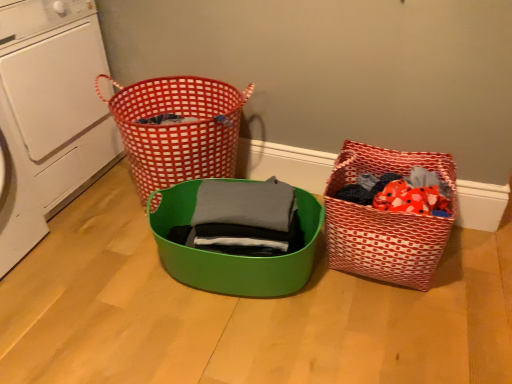
The image size is (512, 384). Identify the location of white plastic washing machine at left. (50, 115).

Based on the photo, measure the distance between point (70, 74) and camera.

The distance of point (70, 74) from camera is 5.40 feet.

Image resolution: width=512 pixels, height=384 pixels. What do you see at coordinates (178, 129) in the screenshot?
I see `red checkered basket at upper left` at bounding box center [178, 129].

Image resolution: width=512 pixels, height=384 pixels. Describe the element at coordinates (232, 255) in the screenshot. I see `matte green bowl at center, placed as the first basket when sorted from left to right` at that location.

You are a GUI agent. You are given a task and a screenshot of the screen. Output one action in this format:
    pyautogui.click(x=<x>, y=<y>)
    Task: Click on the red woven fabric basket at lower right, which is the second basket from left to right
    
    Given the screenshot: What is the action you would take?
    pyautogui.click(x=385, y=220)

Would you say red woven fabric basket at lower right, which is the second basket from left to right, is part of white plastic washing machine at left's contents?

No, red woven fabric basket at lower right, which is the second basket from left to right, is not inside white plastic washing machine at left.

Does white plastic washing machine at left lie behind red woven fabric basket at lower right, which is the second basket from left to right?

Yes, it is behind red woven fabric basket at lower right, which is the second basket from left to right.

Does white plastic washing machine at left have a greater width compared to red woven fabric basket at lower right, which is the second basket from left to right?

Yes.

Find the location of a particular element. washing machine that appears behind the red woven fabric basket at lower right, which appears as the first basket when viewed from the right is located at coordinates (50, 115).

Locate an element on the screen. waste container behind the red woven fabric basket at lower right, which is the second basket from left to right is located at coordinates (178, 129).

Can you tell me how much red woven fabric basket at lower right, which is the second basket from left to right, and red checkered basket at upper left differ in facing direction?

1.84 degrees.

Consider the image. From the image's perspective, is red woven fabric basket at lower right, which appears as the first basket when viewed from the right, on top of red checkered basket at upper left?

No, from the image's perspective, red woven fabric basket at lower right, which appears as the first basket when viewed from the right, is not on top of red checkered basket at upper left.

From a real-world perspective, between red woven fabric basket at lower right, which is the second basket from left to right, and red checkered basket at upper left, who is vertically lower?

red woven fabric basket at lower right, which is the second basket from left to right.

Which object is thinner, matte green bowl at center, which ranks as the second basket in right-to-left order, or red checkered basket at upper left?

matte green bowl at center, which ranks as the second basket in right-to-left order, is thinner.

From a real-world perspective, between matte green bowl at center, placed as the first basket when sorted from left to right, and red checkered basket at upper left, who is vertically higher?

In real-world perspective, matte green bowl at center, placed as the first basket when sorted from left to right, is above.

Consider the image. Which is more to the right, matte green bowl at center, placed as the first basket when sorted from left to right, or red checkered basket at upper left?

matte green bowl at center, placed as the first basket when sorted from left to right, is more to the right.

Based on the photo, what's the angular difference between red checkered basket at upper left and red woven fabric basket at lower right, which appears as the first basket when viewed from the right,'s facing directions?

The facing directions of red checkered basket at upper left and red woven fabric basket at lower right, which appears as the first basket when viewed from the right, are 1.84 degrees apart.

Can you confirm if red checkered basket at upper left is smaller than red woven fabric basket at lower right, which appears as the first basket when viewed from the right?

No.

Can you confirm if red checkered basket at upper left is wider than red woven fabric basket at lower right, which appears as the first basket when viewed from the right?

Yes.

Which is further, (241, 108) or (393, 275)?

Positioned behind is point (241, 108).

In the scene shown: Can you confirm if red woven fabric basket at lower right, which is the second basket from left to right, is bigger than matte green bowl at center, which ranks as the second basket in right-to-left order?

Yes, red woven fabric basket at lower right, which is the second basket from left to right, is bigger than matte green bowl at center, which ranks as the second basket in right-to-left order.

Is red woven fabric basket at lower right, which is the second basket from left to right, thinner than matte green bowl at center, which ranks as the second basket in right-to-left order?

Incorrect, the width of red woven fabric basket at lower right, which is the second basket from left to right, is not less than that of matte green bowl at center, which ranks as the second basket in right-to-left order.

Who is shorter, red woven fabric basket at lower right, which is the second basket from left to right, or matte green bowl at center, placed as the first basket when sorted from left to right?

matte green bowl at center, placed as the first basket when sorted from left to right.

Is red checkered basket at upper left positioned with its back to matte green bowl at center, which ranks as the second basket in right-to-left order?

red checkered basket at upper left is not turned away from matte green bowl at center, which ranks as the second basket in right-to-left order.

Between red checkered basket at upper left and matte green bowl at center, which ranks as the second basket in right-to-left order, which one has less height?

Standing shorter between the two is matte green bowl at center, which ranks as the second basket in right-to-left order.

Are red checkered basket at upper left and matte green bowl at center, placed as the first basket when sorted from left to right, far apart?

They are positioned close to each other.

From a real-world perspective, does red checkered basket at upper left sit lower than matte green bowl at center, placed as the first basket when sorted from left to right?

Yes, from a real-world perspective, red checkered basket at upper left is below matte green bowl at center, placed as the first basket when sorted from left to right.

What's the angular difference between white plastic washing machine at left and red checkered basket at upper left's facing directions?

They differ by 92.6 degrees in their facing directions.

From the image's perspective, which object appears higher, white plastic washing machine at left or red checkered basket at upper left?

white plastic washing machine at left, from the image's perspective.

Is white plastic washing machine at left taller than red checkered basket at upper left?

Indeed, white plastic washing machine at left has a greater height compared to red checkered basket at upper left.

Choose the correct answer: Is white plastic washing machine at left inside red checkered basket at upper left or outside it?

white plastic washing machine at left exists outside the volume of red checkered basket at upper left.

Find the location of `the 1st basket below the white plastic washing machine at left (from the image's perspective)`. the 1st basket below the white plastic washing machine at left (from the image's perspective) is located at coordinates (385, 220).

Identify the location of waste container that is above the red woven fabric basket at lower right, which is the second basket from left to right (from the image's perspective). (178, 129).

When comparing their distances from red checkered basket at upper left, does white plastic washing machine at left or matte green bowl at center, placed as the first basket when sorted from left to right, seem further?

white plastic washing machine at left lies further to red checkered basket at upper left than the other object.

When comparing their distances from red woven fabric basket at lower right, which appears as the first basket when viewed from the right, does white plastic washing machine at left or red checkered basket at upper left seem closer?

red checkered basket at upper left is positioned closer to the anchor red woven fabric basket at lower right, which appears as the first basket when viewed from the right.

Looking at the image, which one is located closer to red checkered basket at upper left, matte green bowl at center, placed as the first basket when sorted from left to right, or white plastic washing machine at left?

matte green bowl at center, placed as the first basket when sorted from left to right, is positioned closer to the anchor red checkered basket at upper left.

Considering their positions, is red woven fabric basket at lower right, which appears as the first basket when viewed from the right, positioned further to white plastic washing machine at left than matte green bowl at center, placed as the first basket when sorted from left to right?

Among the two, red woven fabric basket at lower right, which appears as the first basket when viewed from the right, is located further to white plastic washing machine at left.

Estimate the real-world distances between objects in this image. Which object is closer to red woven fabric basket at lower right, which is the second basket from left to right, red checkered basket at upper left or white plastic washing machine at left?

The object closer to red woven fabric basket at lower right, which is the second basket from left to right, is red checkered basket at upper left.

Looking at the image, which one is located further to white plastic washing machine at left, matte green bowl at center, which ranks as the second basket in right-to-left order, or red checkered basket at upper left?

matte green bowl at center, which ranks as the second basket in right-to-left order, is positioned further to the anchor white plastic washing machine at left.

From the image, which object appears to be farther from matte green bowl at center, which ranks as the second basket in right-to-left order, red woven fabric basket at lower right, which is the second basket from left to right, or white plastic washing machine at left?

white plastic washing machine at left.

Which object lies further to the anchor point white plastic washing machine at left, red woven fabric basket at lower right, which is the second basket from left to right, or red checkered basket at upper left?

red woven fabric basket at lower right, which is the second basket from left to right, is further to white plastic washing machine at left.

At what (x,y) coordinates should I click in order to perform the action: click on basket located between red checkered basket at upper left and red woven fabric basket at lower right, which is the second basket from left to right, in the left-right direction. Please return your answer as a coordinate pair (x, y). Looking at the image, I should click on (232, 255).

Locate an element on the screen. basket between white plastic washing machine at left and red woven fabric basket at lower right, which is the second basket from left to right, in the horizontal direction is located at coordinates (232, 255).

This screenshot has width=512, height=384. I want to click on waste container located between white plastic washing machine at left and red woven fabric basket at lower right, which is the second basket from left to right, in the left-right direction, so click(178, 129).

Where is `waste container between white plastic washing machine at left and matte green bowl at center, which ranks as the second basket in right-to-left order`? Image resolution: width=512 pixels, height=384 pixels. waste container between white plastic washing machine at left and matte green bowl at center, which ranks as the second basket in right-to-left order is located at coordinates (178, 129).